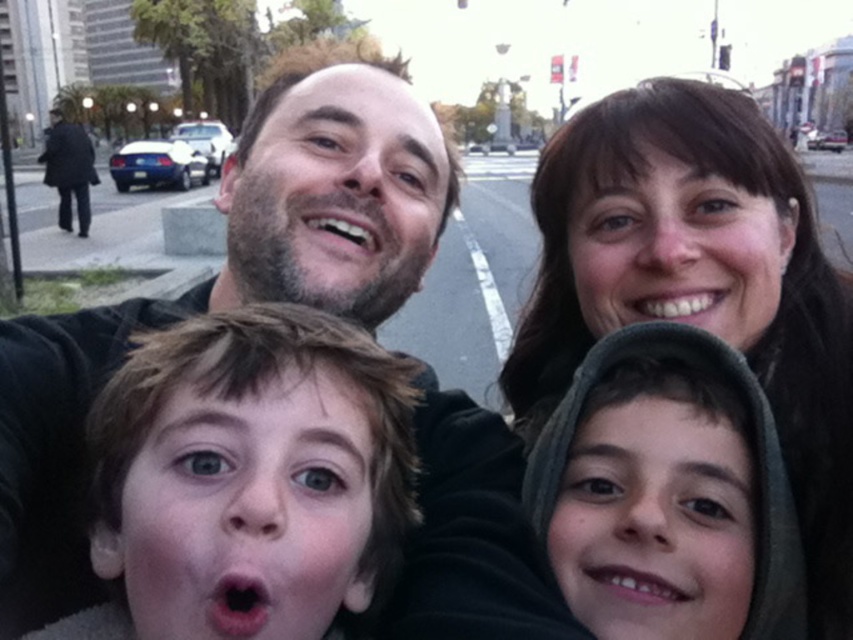
Question: Which point is closer to the camera?

Choices:
 (A) pos(569,525)
 (B) pos(254,132)
 (C) pos(659,577)
 (D) pos(16,321)

Answer: (C)

Question: Is dark brown hair at upper center thinner than pink matte mouth at lower center?

Choices:
 (A) no
 (B) yes

Answer: (A)

Question: Is beige facial hair at center above pink glossy lips at center?

Choices:
 (A) no
 (B) yes

Answer: (B)

Question: Estimate the real-world distances between objects in this image. Which object is closer to the pink matte mouth at lower center?

Choices:
 (A) beige facial hair at center
 (B) smooth gray hoodie at lower right
 (C) smooth skin face at upper right
 (D) dark brown hair at center

Answer: (B)

Question: Can you confirm if smooth gray hoodie at lower right is positioned to the right of smooth skin face at upper right?

Choices:
 (A) no
 (B) yes

Answer: (A)

Question: Which point is closer to the camera taking this photo?

Choices:
 (A) (347, 259)
 (B) (286, 54)
 (C) (575, 589)
 (D) (138, 586)

Answer: (D)